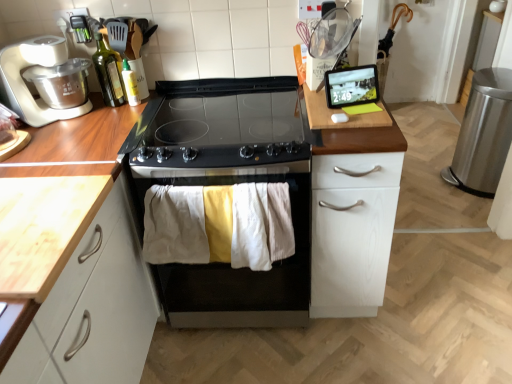
Locate an element on the screen. The image size is (512, 384). unoccupied area in front of black stainless steel oven at center is located at coordinates (252, 360).